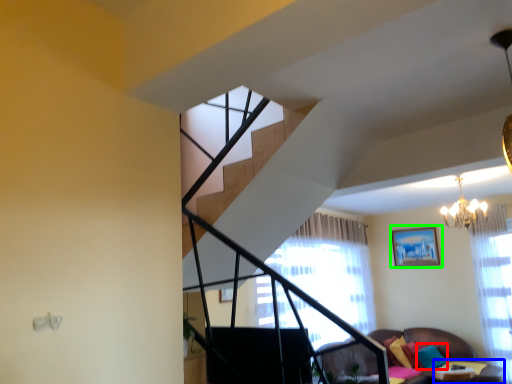
Question: Based on their relative distances, which object is farther from pillow (highlighted by a red box)? Choose from table (highlighted by a blue box) and picture frame (highlighted by a green box).

Choices:
 (A) table
 (B) picture frame

Answer: (B)